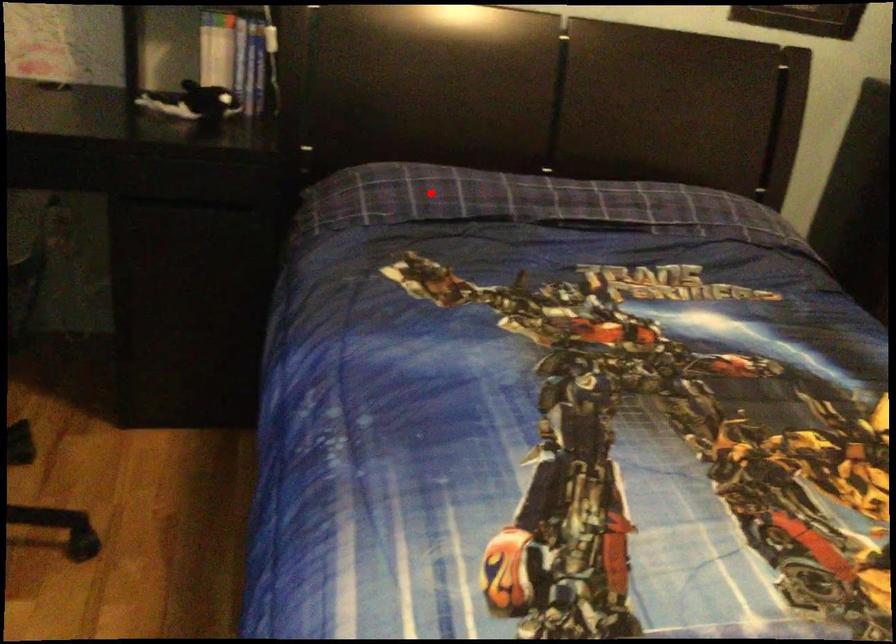
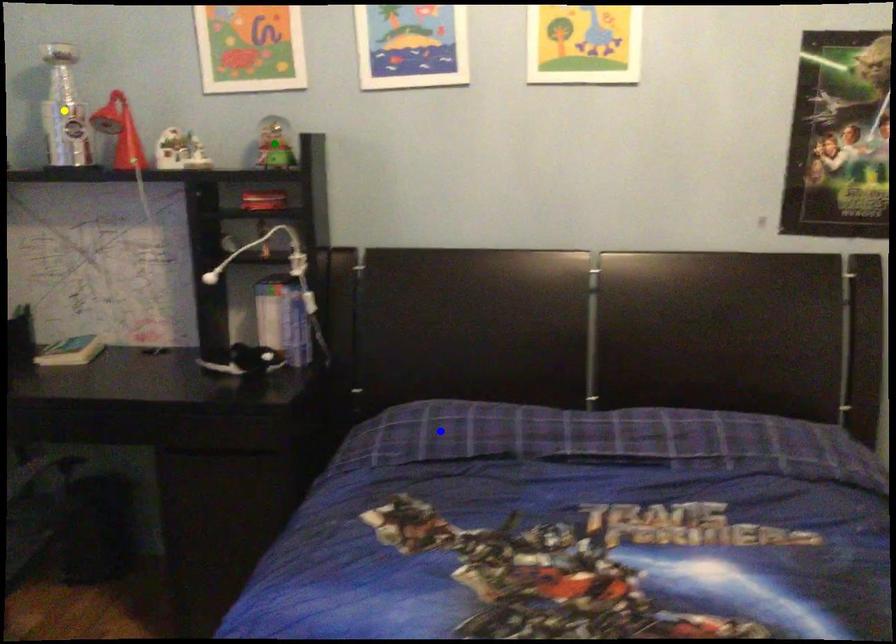
Question: I am providing you with two images of the same scene from different viewpoints. A red point is marked on the first image. You are given multiple points on the second image. Can you choose the point in image 2 that corresponds to the point in image 1?

Choices:
 (A) green point
 (B) blue point
 (C) yellow point

Answer: (B)